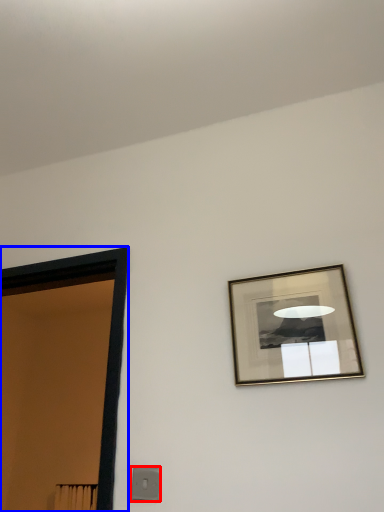
Question: Which of the following is the closest to the observer, light switch (highlighted by a red box) or door (highlighted by a blue box)?

Choices:
 (A) light switch
 (B) door

Answer: (A)